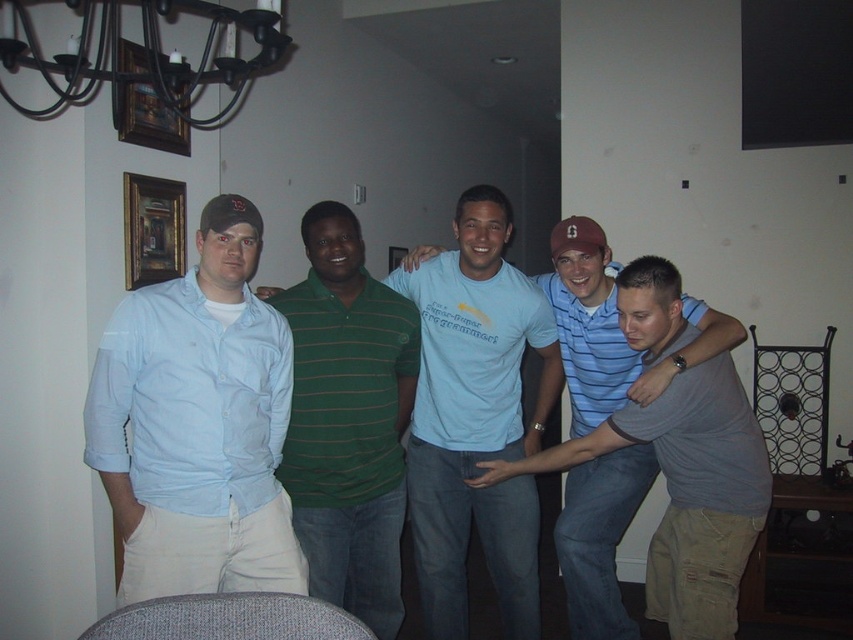
You are standing in the living room and want to reach a point that is exactly at coordinate point [277,394]. If you are currently 10 feet away from that point, how many more feet do you need to move forward to reach it?

You need to move forward 2.24 feet because the point is 7.76 feet away from the viewer. Since you are currently 10 feet away, subtracting 7.76 from 10 gives 2.24 feet remaining.

You are standing in the living room and notice two points marked in the scene. The first point is at coordinate point (331,275) and the second is at point (262,413). Which of these two points is closer to you?

Point (331,275) is closer to you than point (262,413).